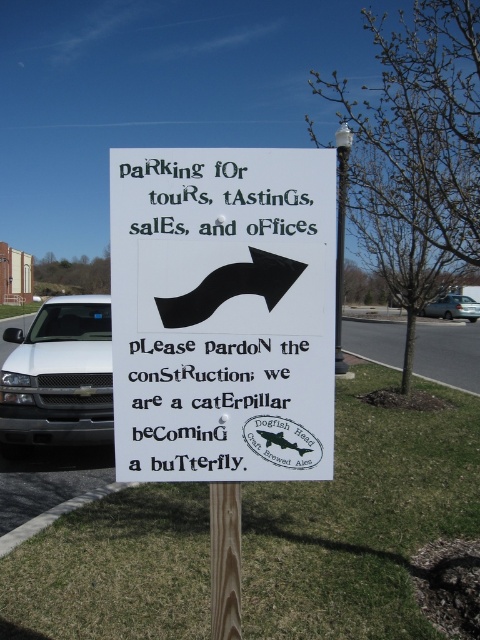
Based on the photo, you are driving a car and see the white paper sign at center and the silver metallic sedan at right. Which object is positioned lower in the image?

The white paper sign at center is positioned lower than the silver metallic sedan at right.

You are a painter trying to paint the black text at upper center and the wooden post at center. Which object requires a wider brush to cover its width?

The black text at upper center might be wider than wooden post at center, so the painter should use a wider brush for the black text at upper center.